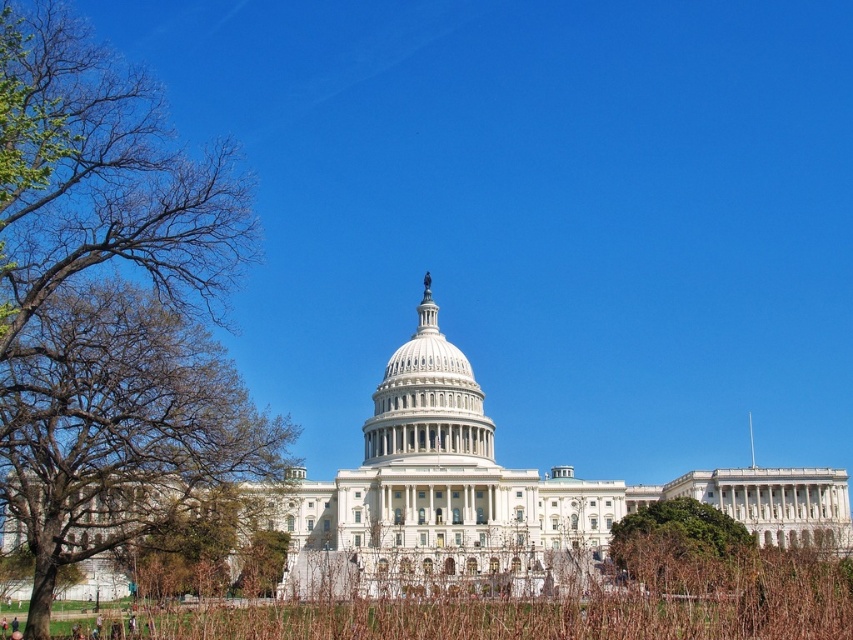
Which is in front, point (103, 536) or point (689, 577)?

Point (689, 577) is more forward.

Who is lower down, brown leafy tree at left or green leafy tree at lower right?

green leafy tree at lower right is below.

This screenshot has width=853, height=640. What are the coordinates of `brown leafy tree at left` in the screenshot? It's located at (107, 296).

Image resolution: width=853 pixels, height=640 pixels. In order to click on brown leafy tree at left in this screenshot , I will do `click(107, 296)`.

Is brown leafy tree at left below white marble dome at center?

No.

Can you confirm if brown leafy tree at left is bigger than white marble dome at center?

Yes.

Between point (51, 573) and point (422, 326), which one is positioned behind?

The point (422, 326) is behind.

Find the location of a particular element. brown leafy tree at left is located at coordinates pyautogui.click(x=107, y=296).

Is white marble dome at center below green leafy tree at lower right?

Actually, white marble dome at center is above green leafy tree at lower right.

Does point (438, 435) lie in front of point (740, 540)?

No, (438, 435) is further to viewer.

Identify the location of white marble dome at center. The image size is (853, 640). (427, 401).